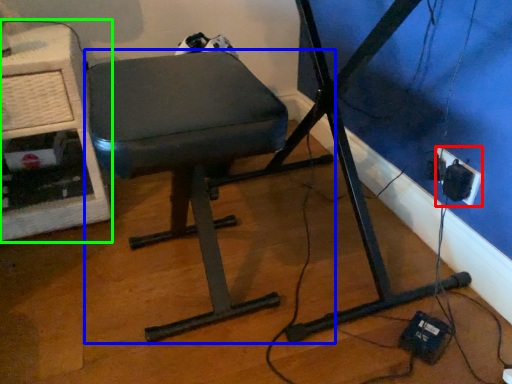
Question: Which is nearer to the electric outlet (highlighted by a red box)? furniture (highlighted by a blue box) or computer desk (highlighted by a green box).

Choices:
 (A) furniture
 (B) computer desk

Answer: (A)